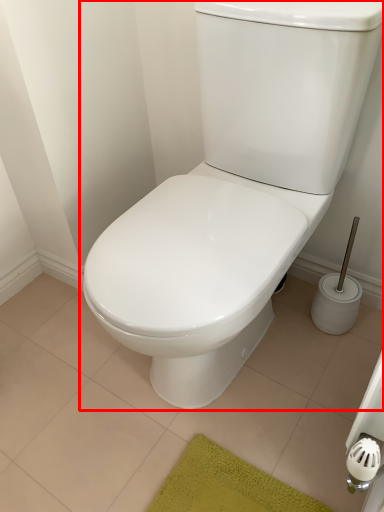
Question: From the image's perspective, where is toilet (annotated by the red box) located relative to tile?

Choices:
 (A) below
 (B) above

Answer: (B)